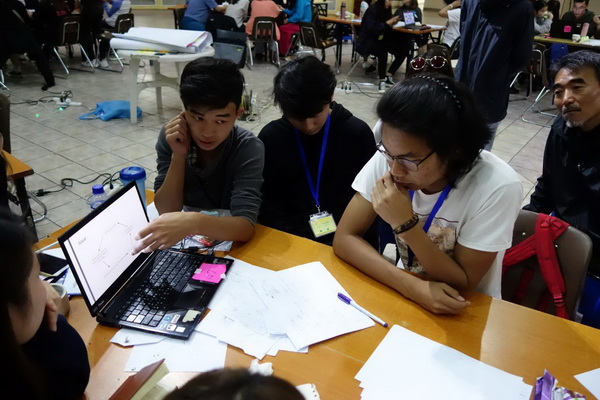
Locate an element on the screen. The image size is (600, 400). sticky note is located at coordinates (212, 270).